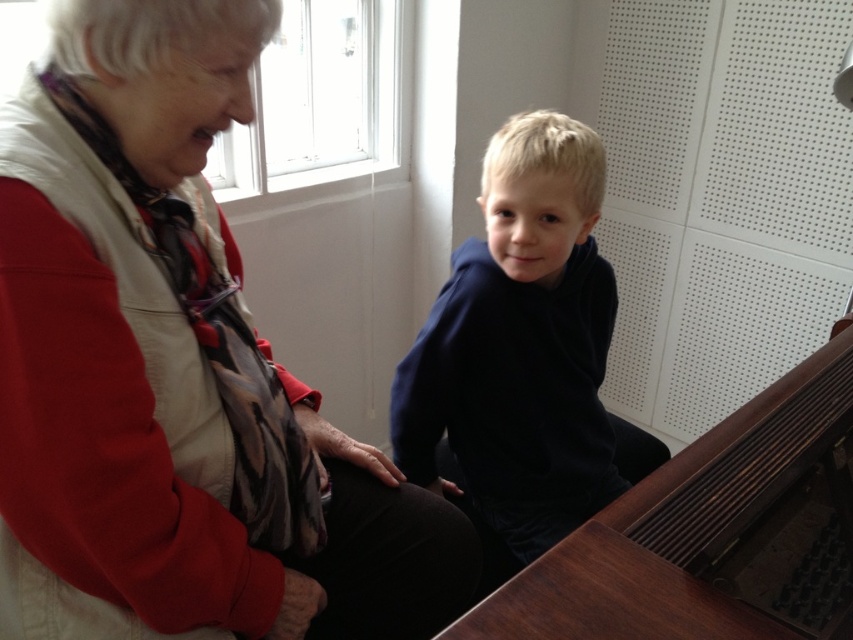
Which of these two, matte red sweater at upper left or brown wooden harpsichord at lower right, stands shorter?

brown wooden harpsichord at lower right is shorter.

Can you confirm if matte red sweater at upper left is wider than brown wooden harpsichord at lower right?

Incorrect, matte red sweater at upper left's width does not surpass brown wooden harpsichord at lower right's.

Is point (202, 289) more distant than point (660, 602)?

Yes, it is.

Identify the location of matte red sweater at upper left. (171, 369).

Is dark blue hoodie at center taller than brown wooden harpsichord at lower right?

Yes, dark blue hoodie at center is taller than brown wooden harpsichord at lower right.

Is dark blue hoodie at center to the left of brown wooden harpsichord at lower right from the viewer's perspective?

Correct, you'll find dark blue hoodie at center to the left of brown wooden harpsichord at lower right.

Image resolution: width=853 pixels, height=640 pixels. Identify the location of dark blue hoodie at center. (524, 348).

Who is higher up, matte red sweater at upper left or dark blue hoodie at center?

dark blue hoodie at center is higher up.

This screenshot has width=853, height=640. Identify the location of matte red sweater at upper left. (171, 369).

Find the location of a particular element. matte red sweater at upper left is located at coordinates (171, 369).